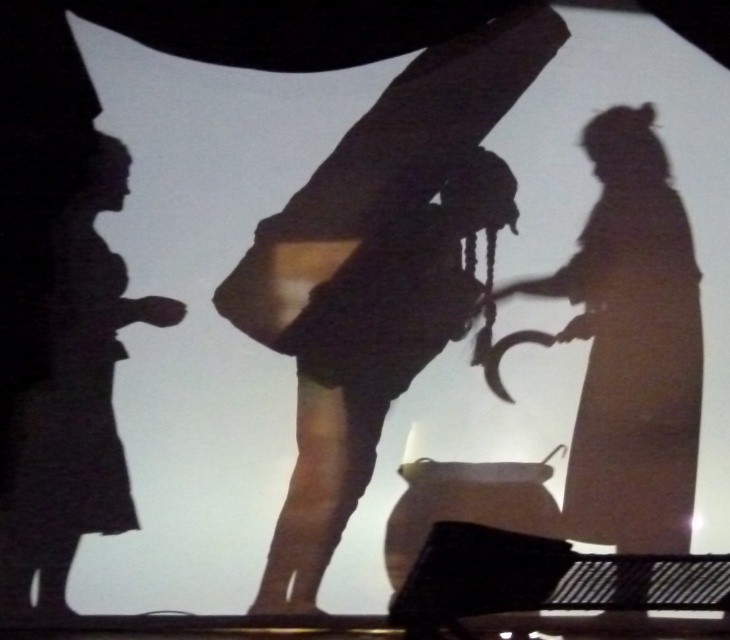
You are an observer standing in front of the silhouette projection. You see the silhouette figure at center and the black matte figure at left. Which one is positioned more to the right side of the scene?

The silhouette figure at center is positioned to the right of the black matte figure at left, so the silhouette figure at center is more to the right side of the scene.

Based on the scene description, where is the silhouette figure at center located in terms of coordinates?

The silhouette figure at center is located at point coordinates of (631, 346).

You are an event planner organizing a silhouette theater performance. You need to ensure that the silhouette figure at center and the black matte figure at left are positioned so that the central figure can gesture towards the left figure without overlapping. Given their sizes, is this arrangement feasible?

The silhouette figure at center is larger than the black matte figure at left. Since the central figure is bigger, it can gesture towards the smaller black matte figure at left without overlapping as long as they are positioned appropriately.